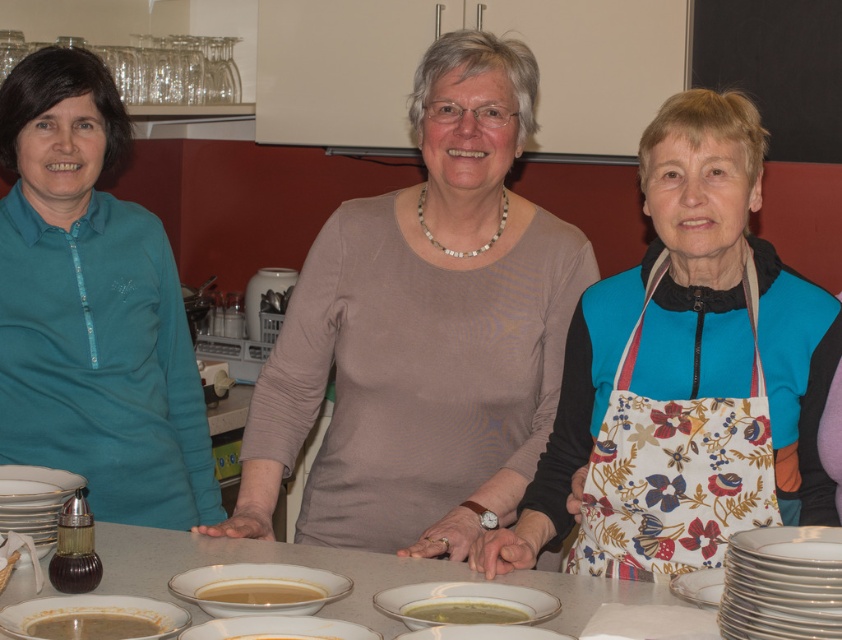
From the picture: Who is more distant from viewer, (381, 618) or (259, 573)?

The point (259, 573) is behind.

Can you confirm if white glossy table at center is shorter than white ceramic bowl at center?

No, white glossy table at center is not shorter than white ceramic bowl at center.

You are a GUI agent. You are given a task and a screenshot of the screen. Output one action in this format:
    pyautogui.click(x=<x>, y=<y>)
    Task: Click on the white glossy table at center
    
    Given the screenshot: What is the action you would take?
    pyautogui.click(x=258, y=561)

Can you confirm if floral apron at center is thinner than white ceramic bowl at center?

No.

Is floral apron at center positioned behind white ceramic bowl at center?

Yes, floral apron at center is further from the viewer.

Find the location of a particular element. floral apron at center is located at coordinates (686, 372).

Is floral apron at center smaller than smooth creamy soup at center?

No.

Does floral apron at center have a greater width compared to smooth creamy soup at center?

Yes, floral apron at center is wider than smooth creamy soup at center.

Which is in front, point (677, 298) or point (290, 634)?

Point (290, 634) is in front.

Identify the location of floral apron at center. The height and width of the screenshot is (640, 842). (686, 372).